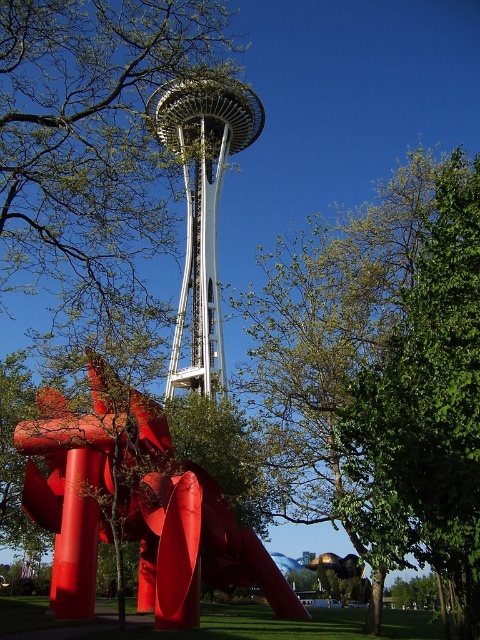
Is glossy red sculpture at lower left below white metallic space needle at center?

Indeed, glossy red sculpture at lower left is positioned under white metallic space needle at center.

Who is positioned more to the left, glossy red sculpture at lower left or white metallic space needle at center?

glossy red sculpture at lower left

Locate an element on the screen. The width and height of the screenshot is (480, 640). glossy red sculpture at lower left is located at coordinates (135, 509).

Locate an element on the screen. The width and height of the screenshot is (480, 640). glossy red sculpture at lower left is located at coordinates tap(135, 509).

Between point (367, 396) and point (153, 97), which one is positioned behind?

The point (153, 97) is more distant.

Does green leafy tree at center have a lesser width compared to white metallic space needle at center?

No, green leafy tree at center is not thinner than white metallic space needle at center.

Between point (419, 241) and point (170, 132), which one is positioned in front?

Point (419, 241) is in front.

Image resolution: width=480 pixels, height=640 pixels. Find the location of `green leafy tree at center`. green leafy tree at center is located at coordinates [384, 376].

Who is lower down, green leafy tree at center or glossy red sculpture at lower left?

glossy red sculpture at lower left

Describe the element at coordinates (384, 376) in the screenshot. I see `green leafy tree at center` at that location.

Measure the distance between point (452, 289) and camera.

The distance of point (452, 289) from camera is 87.61 meters.

Locate an element on the screen. The width and height of the screenshot is (480, 640). green leafy tree at center is located at coordinates (384, 376).